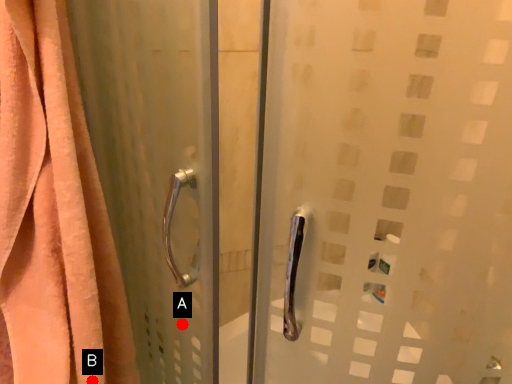
Question: Two points are circled on the image, labeled by A and B beside each circle. Which point appears farthest from the camera in this image?

Choices:
 (A) A is further
 (B) B is further

Answer: (A)